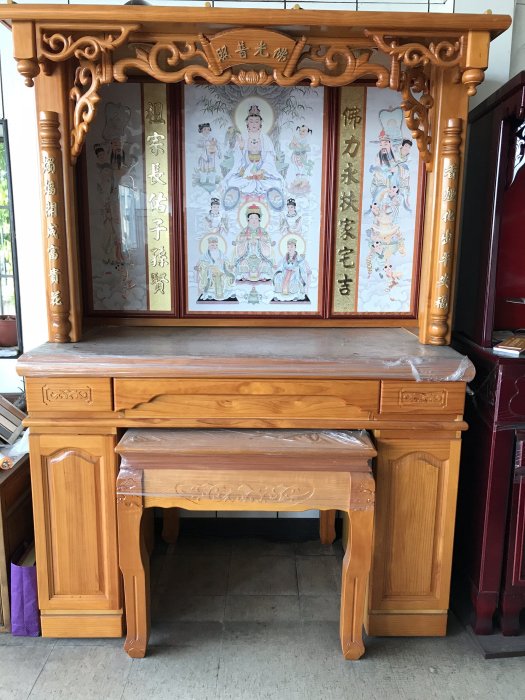
Identify the location of table leg. This screenshot has height=700, width=525. (136, 614), (169, 528), (326, 518), (350, 563).